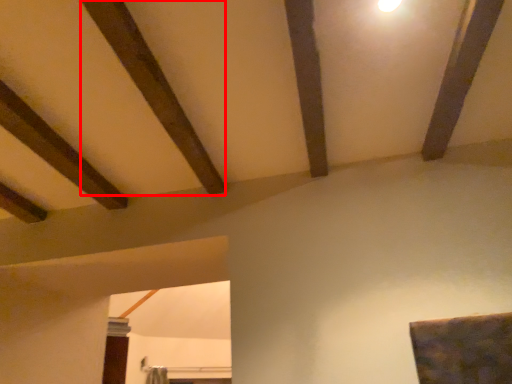
Question: In this image, where is plank (annotated by the red box) located relative to plank?

Choices:
 (A) left
 (B) right

Answer: (A)